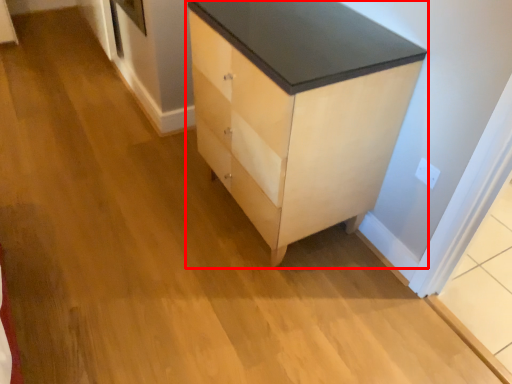
Question: From the image's perspective, where is chest of drawers (annotated by the red box) located in relation to electric outlet in the image?

Choices:
 (A) below
 (B) above

Answer: (B)